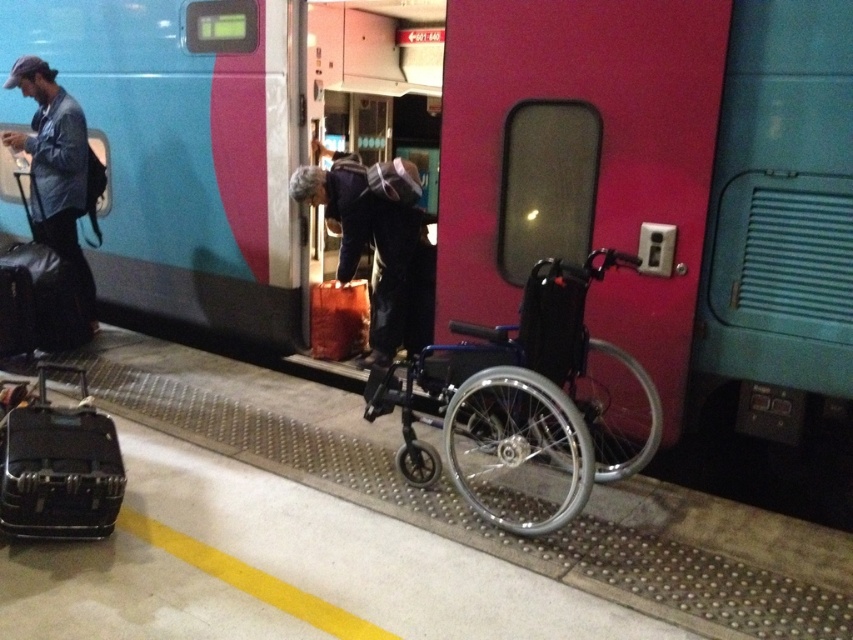
Question: Among these objects, which one is nearest to the camera?

Choices:
 (A) dark blue jacket at center
 (B) blue metallic wheelchair at center
 (C) matte black suitcase at lower left

Answer: (C)

Question: Is teal glossy train at center to the right of blue metallic wheelchair at center from the viewer's perspective?

Choices:
 (A) no
 (B) yes

Answer: (A)

Question: Which of the following is the closest to the observer?

Choices:
 (A) matte black suitcase at lower left
 (B) denim jacket at left

Answer: (A)

Question: Observing the image, what is the correct spatial positioning of teal glossy train at center in reference to dark blue jacket at center?

Choices:
 (A) below
 (B) above

Answer: (B)

Question: Which point is farther from the camera taking this photo?

Choices:
 (A) (51, 188)
 (B) (323, 284)
 (C) (96, 493)

Answer: (B)

Question: Can you confirm if dark blue jacket at center is smaller than denim jacket at left?

Choices:
 (A) yes
 (B) no

Answer: (A)